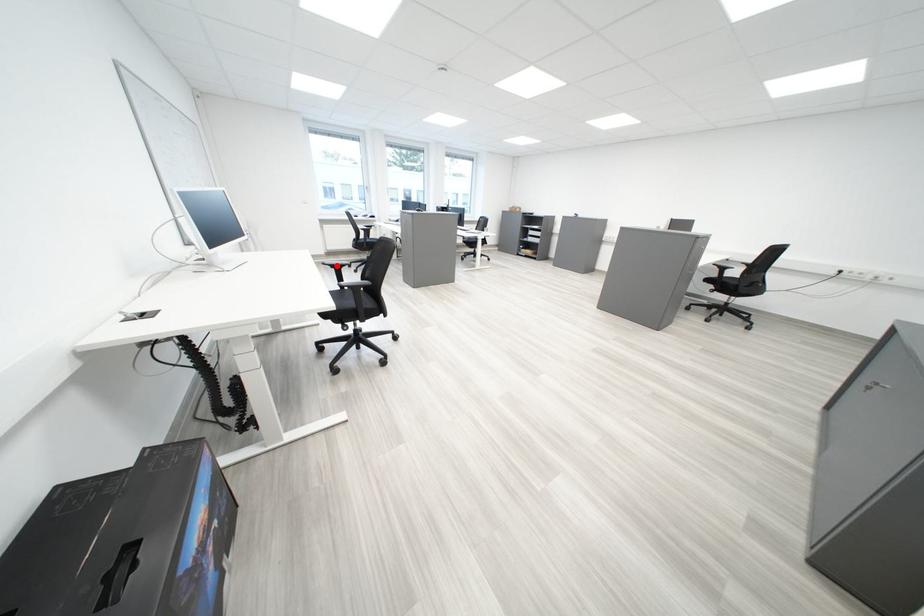
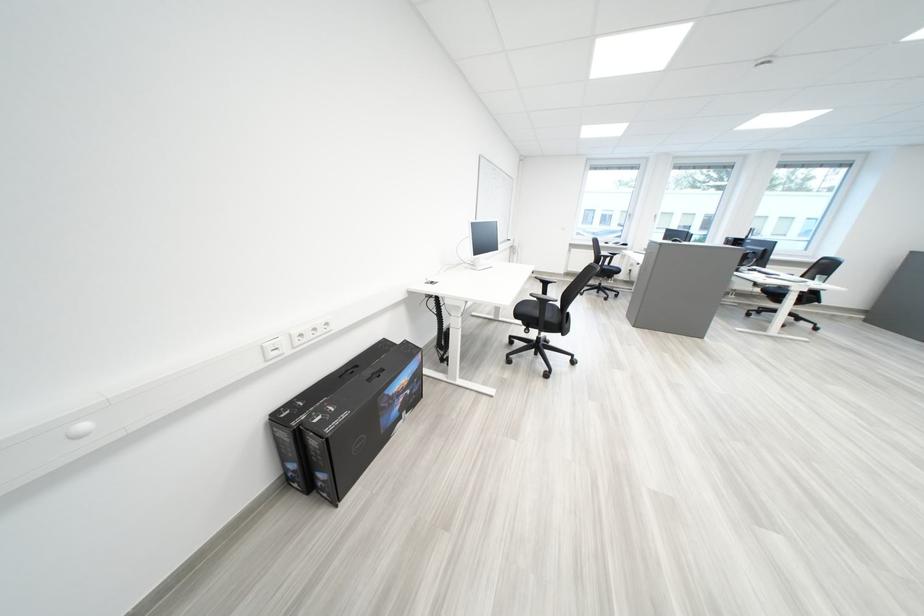
The point at the highlighted location is marked in the first image. Where is the corresponding point in the second image?

(550, 280)